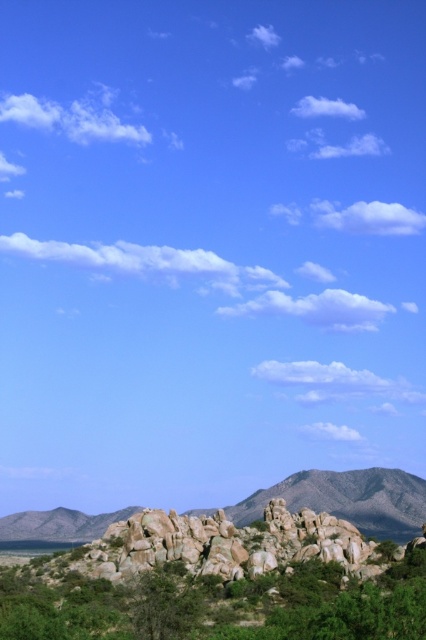
You are a hiker planning to cross the area between the green leafy shrubs at lower center and the rocky gray mountain at lower right. Considering the width of the shrubs and the mountain, which one would you need to navigate around more carefully?

The rocky gray mountain at lower right has a greater width than the green leafy shrubs at lower center, so you would need to navigate around it more carefully due to its larger size.

You are standing at the base of the rocks in the foreground of this landscape. You see two points marked in the image, one at coordinate point (x=117, y=611) and the other at point (x=382, y=477). Which point is closer to you?

Point (x=117, y=611) is closer to the viewer than point (x=382, y=477).

You are a hiker planning to cross the rocky gray mountain at lower right. You see the green leafy shrubs at lower center in your path. Are the shrubs blocking your way to the mountain?

The green leafy shrubs at lower center are located above the rocky gray mountain at lower right, so they are positioned higher up and might not directly block your path to the mountain.